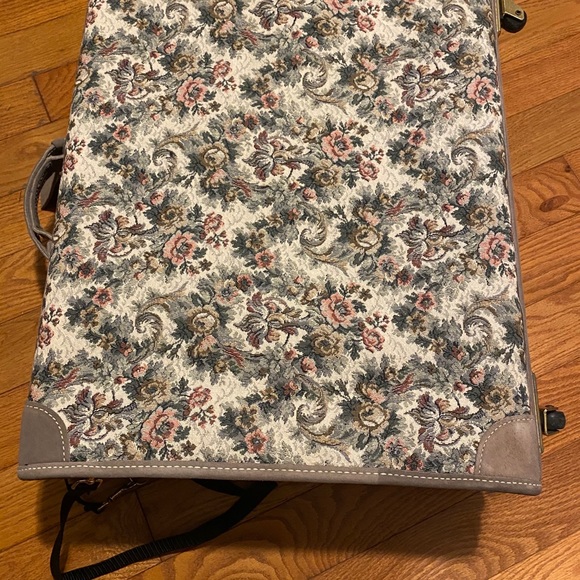
Locate an element on the screen. The height and width of the screenshot is (580, 580). stitch in fabric is located at coordinates (61, 442), (79, 467), (319, 472), (499, 480), (478, 456).